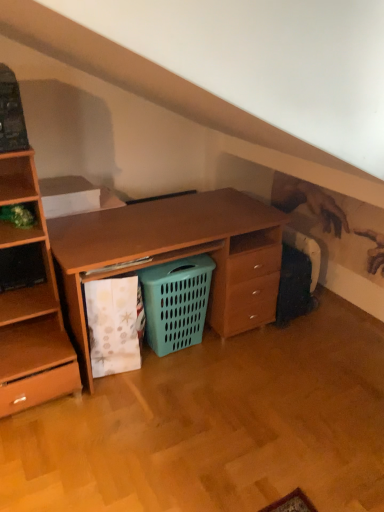
Question: Based on their positions, is teal plastic laundry basket at center located to the left or right of green matte plant at left?

Choices:
 (A) right
 (B) left

Answer: (A)

Question: Considering the positions of point (162, 268) and point (39, 234), is point (162, 268) closer or farther from the camera than point (39, 234)?

Choices:
 (A) farther
 (B) closer

Answer: (A)

Question: Considering the positions of teal plastic laundry basket at center and green matte plant at left in the image, is teal plastic laundry basket at center taller or shorter than green matte plant at left?

Choices:
 (A) tall
 (B) short

Answer: (A)

Question: Considering their positions, is green matte plant at left located in front of or behind teal plastic laundry basket at center?

Choices:
 (A) behind
 (B) front

Answer: (B)

Question: Looking at their shapes, would you say green matte plant at left is wider or thinner than teal plastic laundry basket at center?

Choices:
 (A) wide
 (B) thin

Answer: (A)

Question: From a real-world perspective, is green matte plant at left positioned above or below teal plastic laundry basket at center?

Choices:
 (A) below
 (B) above

Answer: (B)

Question: From the image's perspective, is green matte plant at left above or below teal plastic laundry basket at center?

Choices:
 (A) above
 (B) below

Answer: (A)